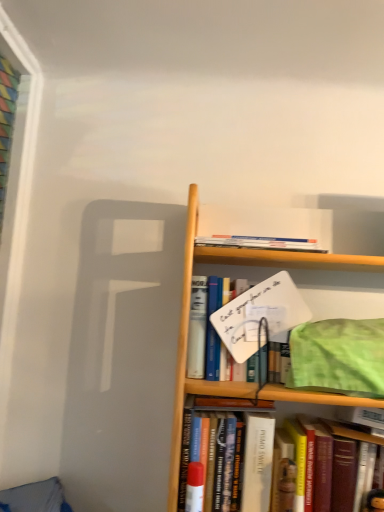
Question: From a real-world perspective, does hardcover book at upper center, marked as the 1th book in a top-to-bottom arrangement, stand above hardcover book at center, the fifth book in the top-to-bottom sequence?

Choices:
 (A) no
 (B) yes

Answer: (B)

Question: Can you confirm if hardcover book at upper center, marked as the 1th book in a top-to-bottom arrangement, is taller than hardcover book at center, the fifth book in the top-to-bottom sequence?

Choices:
 (A) yes
 (B) no

Answer: (B)

Question: Is hardcover book at upper center, arranged as the fifth book when ordered from the bottom, far away from hardcover book at center, the fifth book in the top-to-bottom sequence?

Choices:
 (A) yes
 (B) no

Answer: (B)

Question: Is hardcover book at upper center, marked as the 1th book in a top-to-bottom arrangement, to the left of hardcover book at center, the fifth book in the top-to-bottom sequence, from the viewer's perspective?

Choices:
 (A) yes
 (B) no

Answer: (A)

Question: Is hardcover book at upper center, marked as the 1th book in a top-to-bottom arrangement, oriented away from hardcover book at center, which appears as the 1th book when ordered from the bottom?

Choices:
 (A) no
 (B) yes

Answer: (A)

Question: From the image's perspective, is hardcover book at upper center, marked as the 1th book in a top-to-bottom arrangement, on top of hardcover book at center, the fifth book in the top-to-bottom sequence?

Choices:
 (A) no
 (B) yes

Answer: (B)

Question: Is hardcover book at center, the fifth book in the top-to-bottom sequence, a part of hardcover book at center, arranged as the third book when ordered from the bottom?

Choices:
 (A) no
 (B) yes

Answer: (B)

Question: Is hardcover book at center, which appears as the third book when viewed from the top, thinner than hardcover book at center, the fifth book in the top-to-bottom sequence?

Choices:
 (A) no
 (B) yes

Answer: (A)

Question: Is the depth of hardcover book at center, arranged as the third book when ordered from the bottom, less than that of hardcover book at center, which appears as the 1th book when ordered from the bottom?

Choices:
 (A) yes
 (B) no

Answer: (A)

Question: Is hardcover book at center, arranged as the third book when ordered from the bottom, placed right next to hardcover book at center, which appears as the 1th book when ordered from the bottom?

Choices:
 (A) no
 (B) yes

Answer: (A)

Question: From a real-world perspective, does hardcover book at center, which appears as the third book when viewed from the top, stand above hardcover book at center, which appears as the 1th book when ordered from the bottom?

Choices:
 (A) yes
 (B) no

Answer: (A)

Question: Can you confirm if hardcover book at center, arranged as the third book when ordered from the bottom, is wider than hardcover book at center, which appears as the 1th book when ordered from the bottom?

Choices:
 (A) yes
 (B) no

Answer: (A)

Question: Does hardcover book at upper center, arranged as the fifth book when ordered from the bottom, appear on the right side of hardcover book at center, arranged as the third book when ordered from the bottom?

Choices:
 (A) no
 (B) yes

Answer: (A)